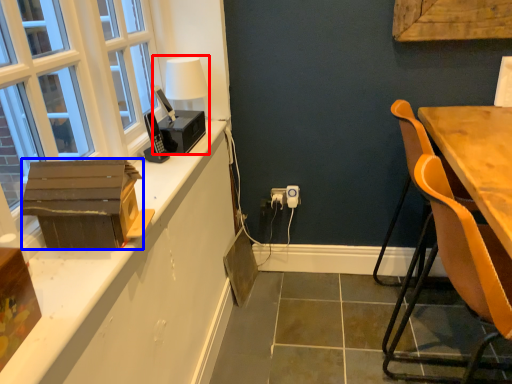
Question: Which of the following is the farthest to the observer, table lamp (highlighted by a red box) or cardboard box (highlighted by a blue box)?

Choices:
 (A) table lamp
 (B) cardboard box

Answer: (A)